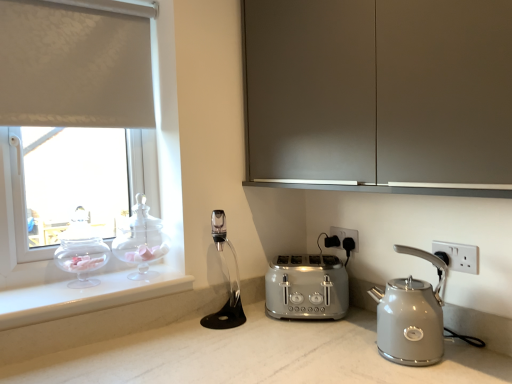
Question: From a real-world perspective, is matte gray cabinet at upper center physically above clear glass jar at window, which appears as the second tea pot when viewed from the left?

Choices:
 (A) no
 (B) yes

Answer: (B)

Question: Is matte gray cabinet at upper center smaller than clear glass jar at window, which is the first tea pot from right to left?

Choices:
 (A) yes
 (B) no

Answer: (B)

Question: Is matte gray cabinet at upper center oriented towards clear glass jar at window, which is the first tea pot from right to left?

Choices:
 (A) yes
 (B) no

Answer: (B)

Question: From the image's perspective, is matte gray cabinet at upper center beneath clear glass jar at window, which is the first tea pot from right to left?

Choices:
 (A) no
 (B) yes

Answer: (A)

Question: Is matte gray cabinet at upper center behind clear glass jar at window, which is the first tea pot from right to left?

Choices:
 (A) no
 (B) yes

Answer: (A)

Question: Is matte gray cabinet at upper center not within clear glass jar at window, which is the first tea pot from right to left?

Choices:
 (A) no
 (B) yes

Answer: (B)

Question: Is white plastic electric outlet at right, which is the 2th electric outlet in back-to-front order, to the right of transparent glass teapot at left, which is counted as the 1th tea pot, starting from the left, from the viewer's perspective?

Choices:
 (A) no
 (B) yes

Answer: (B)

Question: Is white plastic electric outlet at right, which is the 2th electric outlet in back-to-front order, bigger than transparent glass teapot at left, which is the 2th tea pot in right-to-left order?

Choices:
 (A) no
 (B) yes

Answer: (A)

Question: Is white plastic electric outlet at right, which is the 2th electric outlet in back-to-front order, aimed at transparent glass teapot at left, which is the 2th tea pot in right-to-left order?

Choices:
 (A) no
 (B) yes

Answer: (A)

Question: Is white plastic electric outlet at right, which is counted as the first electric outlet, starting from the front, far away from transparent glass teapot at left, which is counted as the 1th tea pot, starting from the left?

Choices:
 (A) yes
 (B) no

Answer: (A)

Question: Is white plastic electric outlet at right, which is the first electric outlet in right-to-left order, smaller than transparent glass teapot at left, which is the 2th tea pot in right-to-left order?

Choices:
 (A) yes
 (B) no

Answer: (A)

Question: Can you confirm if white plastic electric outlet at right, which is the 2th electric outlet in back-to-front order, is shorter than transparent glass teapot at left, which is counted as the 1th tea pot, starting from the left?

Choices:
 (A) no
 (B) yes

Answer: (B)

Question: From a real-world perspective, does transparent glass teapot at left, which is counted as the 1th tea pot, starting from the left, stand above white plastic electric outlet at right, which is the first electric outlet in right-to-left order?

Choices:
 (A) yes
 (B) no

Answer: (A)